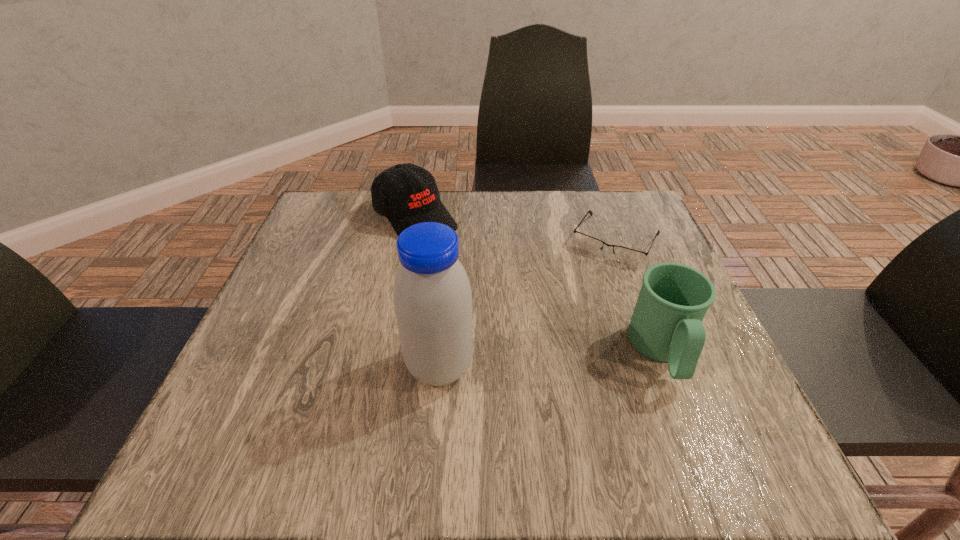
Identify the location of free space located 0.180m on the front-facing side of the shortest object. The height and width of the screenshot is (540, 960). (573, 313).

Find the location of a particular element. Image resolution: width=960 pixels, height=540 pixels. free space located 0.350m on the front-facing side of the shortest object is located at coordinates (539, 373).

Identify the location of baseball cap that is at the far edge. The image size is (960, 540). (407, 194).

Find the location of `spectacles that is at the far edge`. spectacles that is at the far edge is located at coordinates (626, 255).

The width and height of the screenshot is (960, 540). What are the coordinates of `soya milk present at the near edge` in the screenshot? It's located at (432, 296).

At what (x,y) coordinates should I click in order to perform the action: click on mug that is at the near edge. Please return your answer as a coordinate pair (x, y). Looking at the image, I should click on (666, 325).

Locate an element on the screen. mug that is at the right edge is located at coordinates (666, 325).

Find the location of a particular element. The image size is (960, 540). spectacles that is at the right edge is located at coordinates (626, 255).

Where is `object that is at the far right corner`? The width and height of the screenshot is (960, 540). object that is at the far right corner is located at coordinates (626, 255).

Find the location of a particular element. object present at the near right corner is located at coordinates pos(666,325).